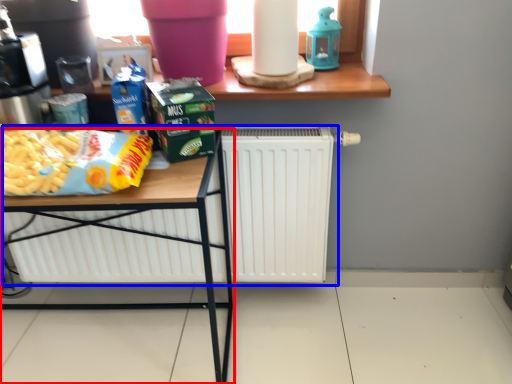
Question: Which point is further to the camera, table (highlighted by a red box) or radiator (highlighted by a blue box)?

Choices:
 (A) table
 (B) radiator

Answer: (B)